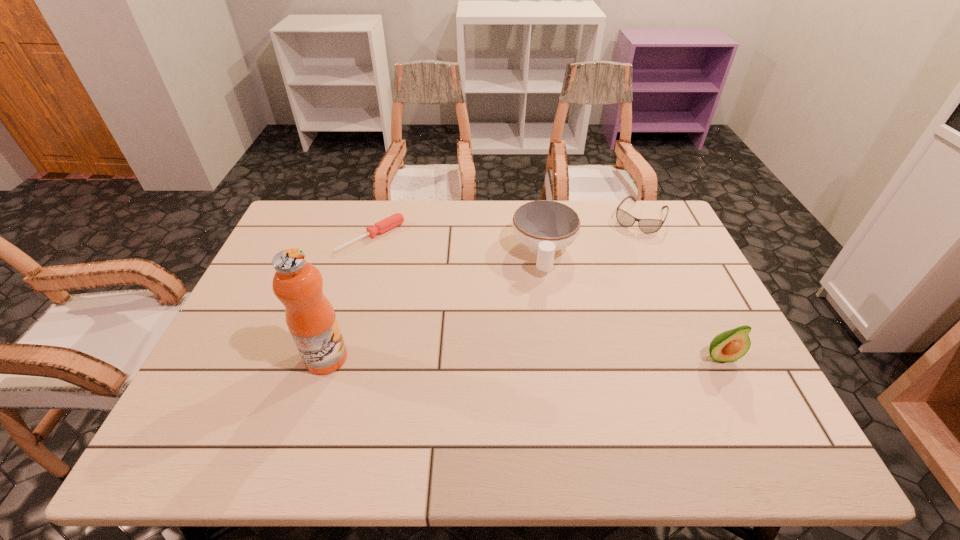
Where is `vacant space on the desktop that is between the tallest object and the avocado and is positioned at the tip of the shortest object`? This screenshot has height=540, width=960. vacant space on the desktop that is between the tallest object and the avocado and is positioned at the tip of the shortest object is located at coordinates (523, 357).

Where is `free space on the desktop that is between the tallest object and the avocado and is positioned on the side with the handle of the third object from right to left`? The width and height of the screenshot is (960, 540). free space on the desktop that is between the tallest object and the avocado and is positioned on the side with the handle of the third object from right to left is located at coordinates (543, 357).

Find the location of a particular element. The width and height of the screenshot is (960, 540). free space on the desktop that is between the fruit juice and the avocado and is positioned on the lenses of the sunglasses is located at coordinates (568, 357).